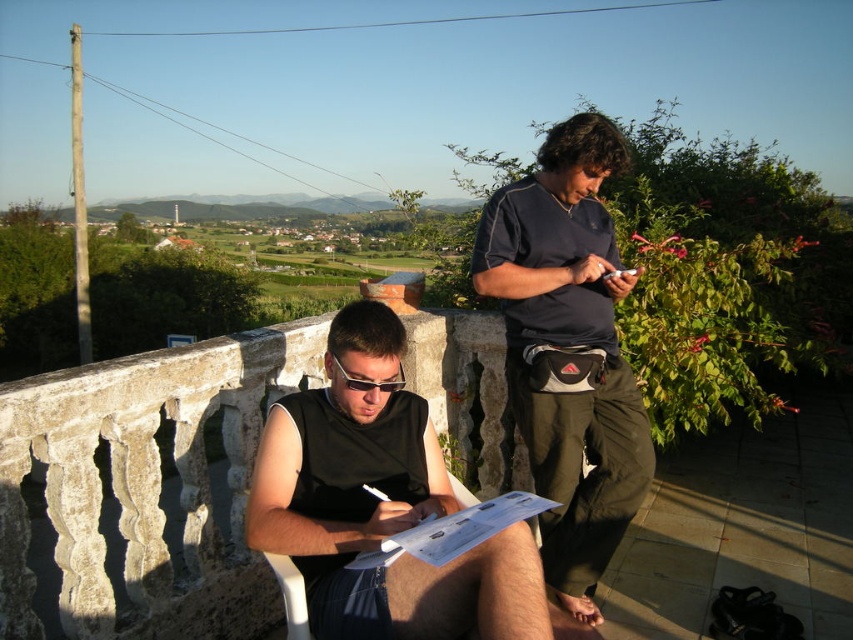
Is black matte vest at center to the left of dark blue fabric shirt at upper center from the viewer's perspective?

Yes, black matte vest at center is to the left of dark blue fabric shirt at upper center.

Based on the photo, does black matte vest at center have a greater width compared to dark blue fabric shirt at upper center?

Yes, black matte vest at center is wider than dark blue fabric shirt at upper center.

Between point (361, 417) and point (527, 413), which one is positioned in front?

Point (361, 417) is more forward.

The height and width of the screenshot is (640, 853). Find the location of `black matte vest at center`. black matte vest at center is located at coordinates (379, 502).